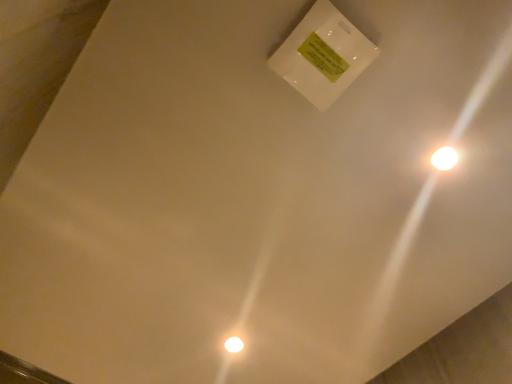
In order to click on free space in front of white glossy light at upper right in this screenshot , I will do `click(452, 90)`.